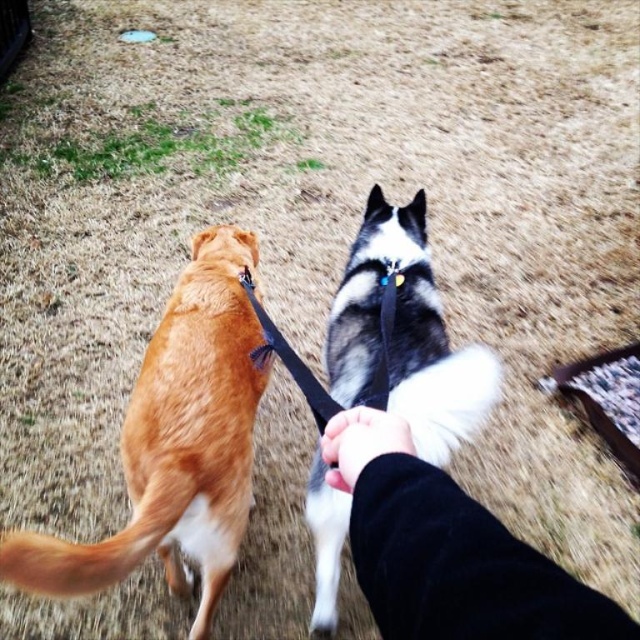
Question: Which of the following is the closest to the observer?

Choices:
 (A) pos(403,522)
 (B) pos(179,344)
 (C) pos(365,220)

Answer: (A)

Question: Which object appears farthest from the camera in this image?

Choices:
 (A) black fleece hand at center
 (B) golden fur dog at left

Answer: (B)

Question: Is golden fur dog at left bigger than black fleece hand at center?

Choices:
 (A) yes
 (B) no

Answer: (A)

Question: In this image, where is black fleece hand at center located relative to black and white fur at center?

Choices:
 (A) left
 (B) right

Answer: (A)

Question: Does golden fur dog at left have a greater width compared to black and white fur at center?

Choices:
 (A) no
 (B) yes

Answer: (B)

Question: Which object is positioned farthest from the black and white fur at center?

Choices:
 (A) golden fur dog at left
 (B) black fleece hand at center

Answer: (B)